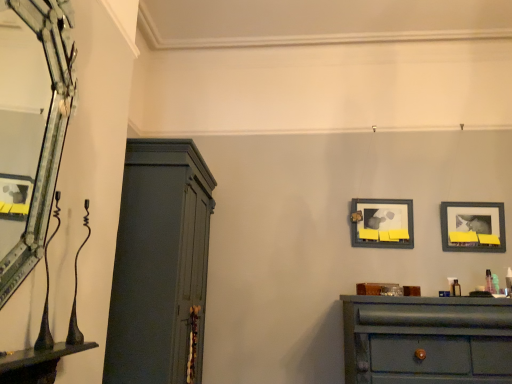
Question: Can you confirm if matte black picture frame at upper right, which ranks as the first picture frame in right-to-left order, is positioned to the right of matte gray cupboard at left?

Choices:
 (A) no
 (B) yes

Answer: (B)

Question: Can you confirm if matte black picture frame at upper right, which ranks as the first picture frame in right-to-left order, is bigger than matte gray cupboard at left?

Choices:
 (A) no
 (B) yes

Answer: (A)

Question: Is matte black picture frame at upper right, which ranks as the first picture frame in right-to-left order, further to the viewer compared to matte gray cupboard at left?

Choices:
 (A) no
 (B) yes

Answer: (B)

Question: Is matte black picture frame at upper right, the 2th picture frame viewed from the left, taller than matte gray cupboard at left?

Choices:
 (A) yes
 (B) no

Answer: (B)

Question: Is matte black picture frame at upper right, which ranks as the first picture frame in right-to-left order, positioned far away from matte gray cupboard at left?

Choices:
 (A) no
 (B) yes

Answer: (B)

Question: Is matte black picture frame at upper right, which ranks as the first picture frame in right-to-left order, turned away from matte gray cupboard at left?

Choices:
 (A) no
 (B) yes

Answer: (A)

Question: From a real-world perspective, is matte gray cupboard at left below wooden framed picture at center, which ranks as the first picture frame in left-to-right order?

Choices:
 (A) yes
 (B) no

Answer: (A)

Question: Can you confirm if matte gray cupboard at left is positioned to the right of wooden framed picture at center, the second picture frame positioned from the right?

Choices:
 (A) yes
 (B) no

Answer: (B)

Question: Is matte gray cupboard at left looking in the opposite direction of wooden framed picture at center, the second picture frame positioned from the right?

Choices:
 (A) no
 (B) yes

Answer: (A)

Question: From a real-world perspective, is matte gray cupboard at left on wooden framed picture at center, the second picture frame positioned from the right?

Choices:
 (A) yes
 (B) no

Answer: (B)

Question: Is wooden framed picture at center, the second picture frame positioned from the right, inside matte gray cupboard at left?

Choices:
 (A) no
 (B) yes

Answer: (A)

Question: From the image's perspective, would you say matte gray cupboard at left is positioned over wooden framed picture at center, which ranks as the first picture frame in left-to-right order?

Choices:
 (A) no
 (B) yes

Answer: (A)

Question: Does wooden framed picture at center, the second picture frame positioned from the right, have a greater width compared to matte gray cupboard at left?

Choices:
 (A) yes
 (B) no

Answer: (B)